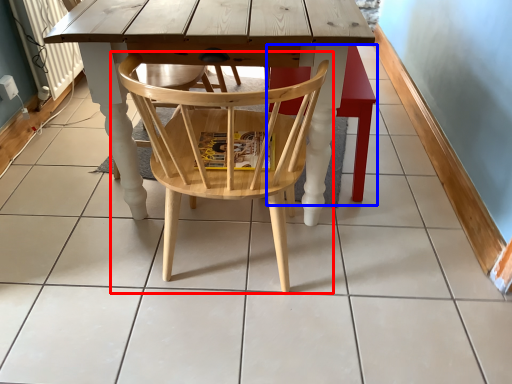
Question: Which object appears farthest to the camera in this image, chair (highlighted by a red box) or bar stool (highlighted by a blue box)?

Choices:
 (A) chair
 (B) bar stool

Answer: (B)